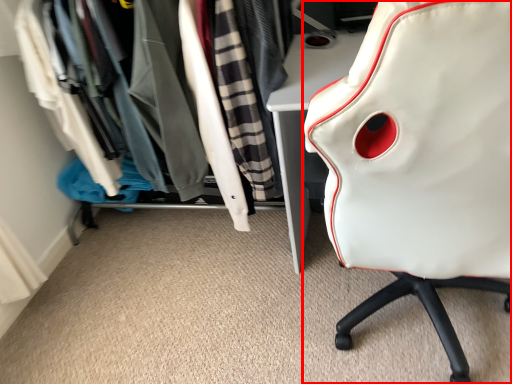
Question: From the image's perspective, considering the relative positions of chair (annotated by the red box) and closet in the image provided, where is chair (annotated by the red box) located with respect to the staircase?

Choices:
 (A) below
 (B) above

Answer: (A)